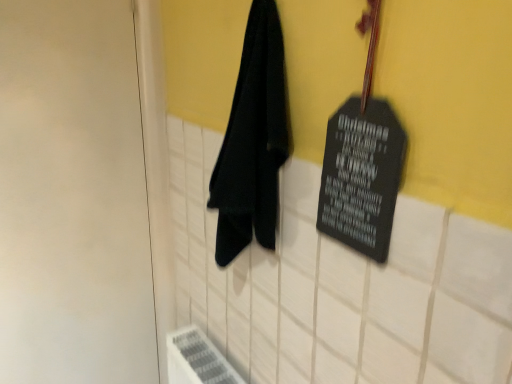
Question: From their relative heights in the image, would you say white matte door at left is taller or shorter than black matte sign at upper right?

Choices:
 (A) tall
 (B) short

Answer: (A)

Question: From the image's perspective, is white matte door at left located above or below black matte sign at upper right?

Choices:
 (A) above
 (B) below

Answer: (B)

Question: Based on their relative distances, which object is nearer to the white matte door at left?

Choices:
 (A) black fabric towel at center
 (B) black matte sign at upper right

Answer: (A)

Question: Which of these objects is positioned farthest from the black matte sign at upper right?

Choices:
 (A) white matte door at left
 (B) black fabric towel at center

Answer: (A)